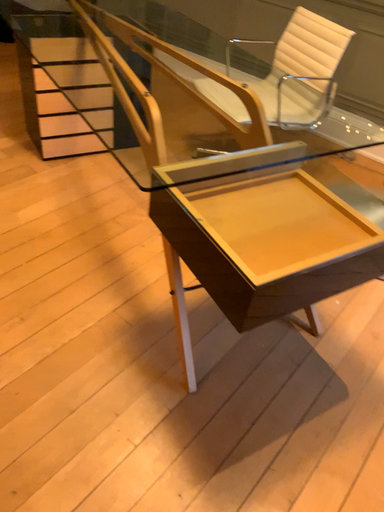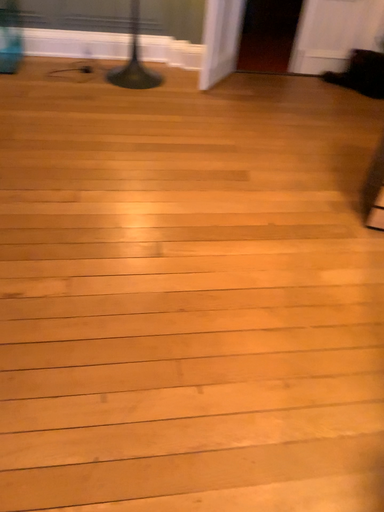
Question: Which way did the camera rotate in the video?

Choices:
 (A) rotated left
 (B) rotated right

Answer: (A)